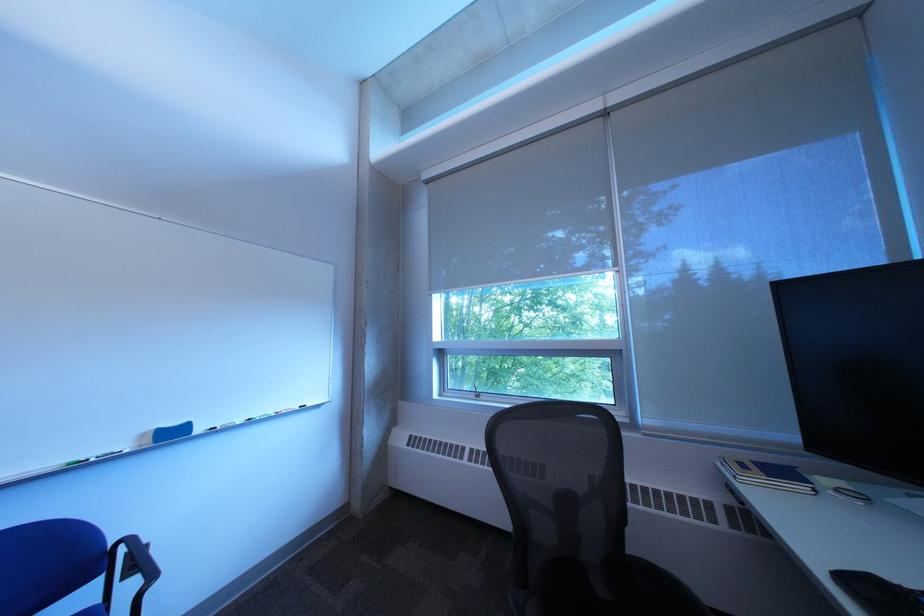
The image size is (924, 616). What do you see at coordinates (614, 590) in the screenshot?
I see `the black chair sitting surface` at bounding box center [614, 590].